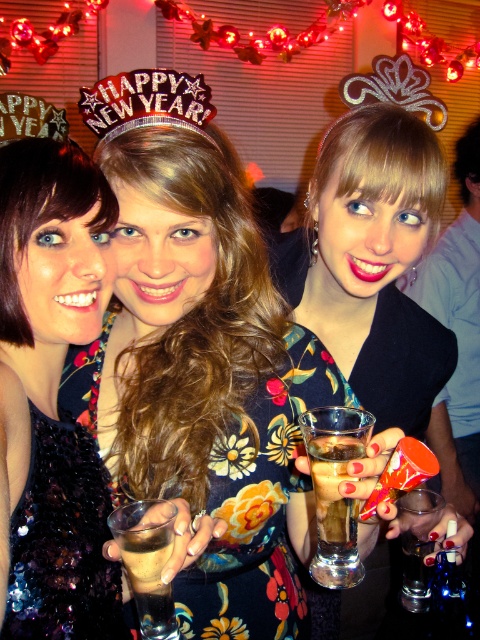
You are at a New Year party and want to take a photo. There are two points marked in the image. If you stand at point [103,576], will you be behind or in front of point [332,506]?

Point [103,576] is behind point [332,506].

You are a photographer setting up for a group photo. You have two dresses in the frame, the sequined dress at left and the matte black dress at center. Based on their sizes, which dress should you focus on to ensure it takes up more of the photo?

The matte black dress at center should be focused on because it occupies more space in the frame than the sequined dress at left.